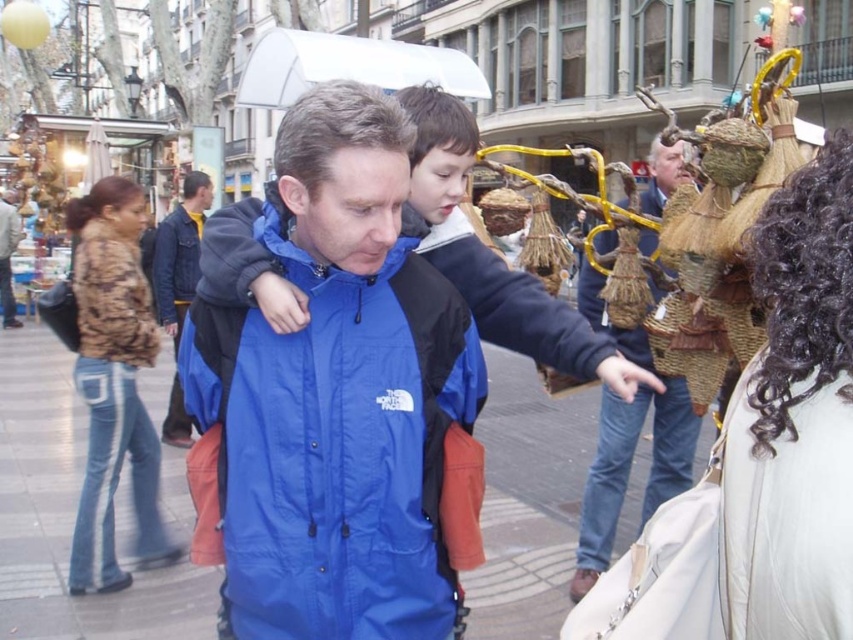
You are a photographer trying to capture the man in the blue fabric jacket at center and the curly hair at upper right in the same frame. Which object is narrower so that it won

The curly hair at upper right is narrower than the blue fabric jacket at center, so it would fit better within the frame if space is limited.

You are a fashion designer observing a street scene with a blue nylon jacket at center and a camo fabric jacket at left. Which jacket takes up more visual space in the scene?

The camo fabric jacket at left takes up more visual space than the blue nylon jacket at center.